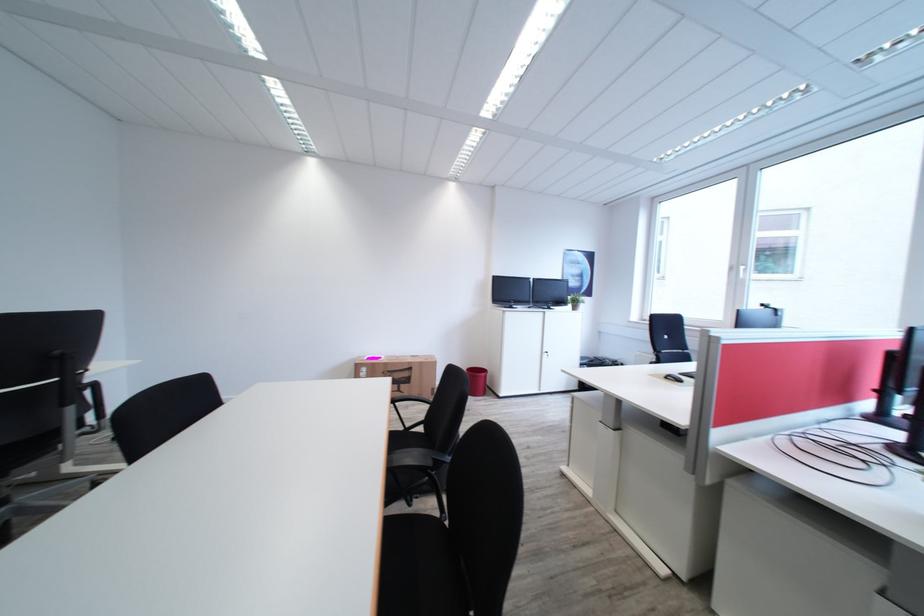
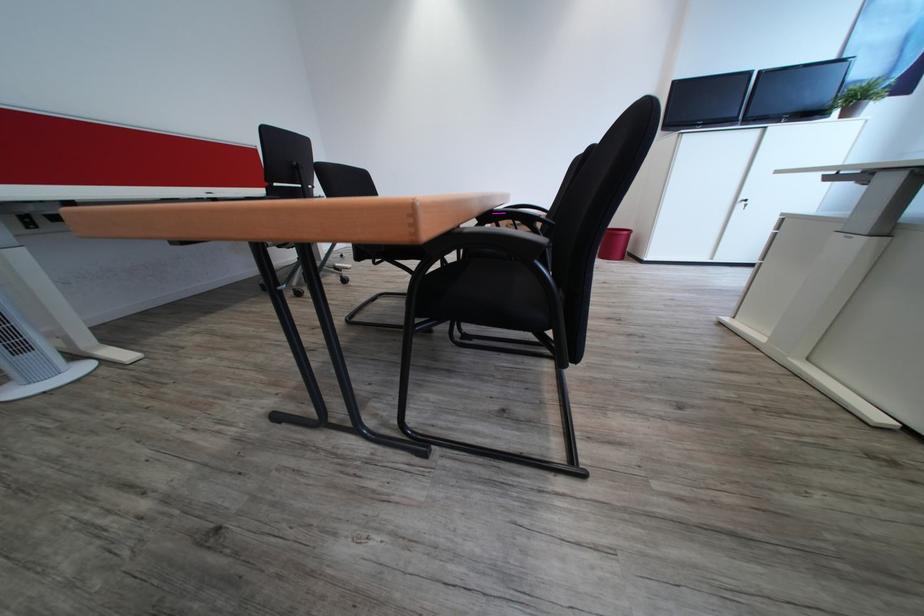
Locate, in the second image, the point that corresponds to point (579, 308) in the first image.

(845, 116)